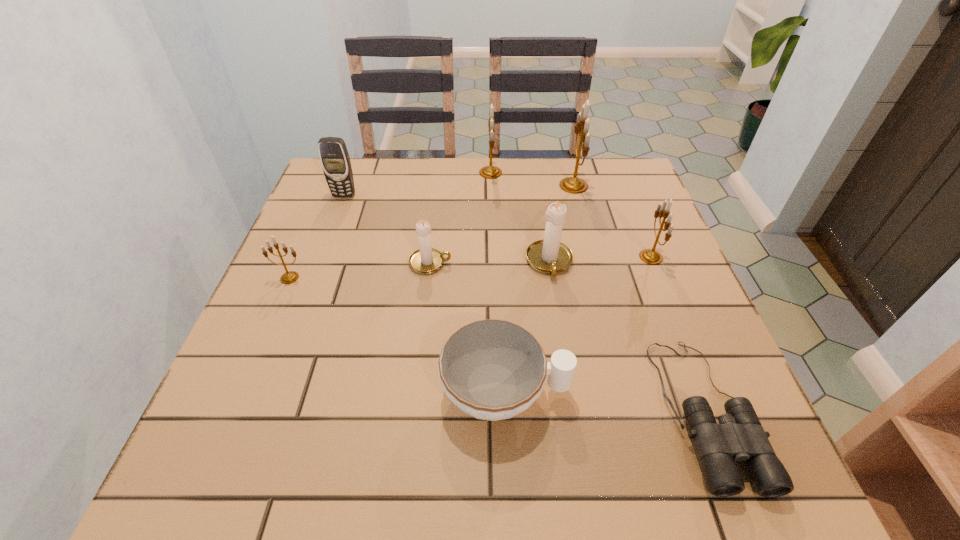
Image resolution: width=960 pixels, height=540 pixels. Find the location of `object present at the far right corner`. object present at the far right corner is located at coordinates (575, 185).

You are a GUI agent. You are given a task and a screenshot of the screen. Output one action in this format:
    pyautogui.click(x=<x>, y=<y>)
    Task: Click on the object that is at the near right corner
    The image size is (960, 540).
    Given the screenshot: What is the action you would take?
    pyautogui.click(x=739, y=435)

Locate an element on the screen. This screenshot has height=540, width=960. free region at the far edge of the desktop is located at coordinates (522, 192).

The height and width of the screenshot is (540, 960). In the image, there is a desktop. Find the location of `free space at the near edge`. free space at the near edge is located at coordinates (441, 483).

Locate an element on the screen. vacant space at the left edge is located at coordinates (297, 226).

The width and height of the screenshot is (960, 540). Find the location of `vacant area at the right edge of the desktop`. vacant area at the right edge of the desktop is located at coordinates (643, 305).

At what (x,y) coordinates should I click in order to perform the action: click on vacant space at the far left corner of the desktop. Please return your answer as a coordinate pair (x, y). Image resolution: width=960 pixels, height=540 pixels. Looking at the image, I should click on (377, 172).

In the image, there is a desktop. At what (x,y) coordinates should I click in order to perform the action: click on vacant space at the near left corner. Please return your answer as a coordinate pair (x, y). This screenshot has width=960, height=540. Looking at the image, I should click on (231, 481).

Locate an element on the screen. The width and height of the screenshot is (960, 540). vacant space at the far right corner of the desktop is located at coordinates (597, 170).

What are the coordinates of `vacant area that lies between the cellular telephone and the smaller white candle holder` in the screenshot? It's located at (387, 229).